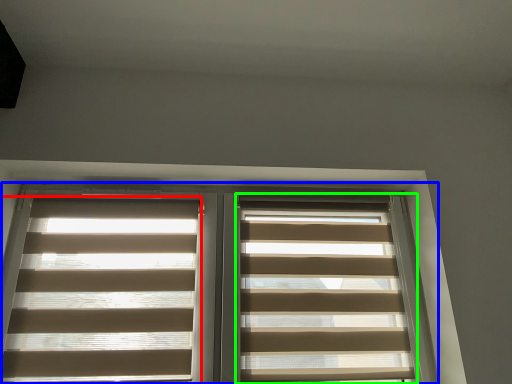
Question: Based on their relative distances, which object is farther from window blind (highlighted by a red box)? Choose from window (highlighted by a blue box) and window blind (highlighted by a green box).

Choices:
 (A) window
 (B) window blind

Answer: (B)